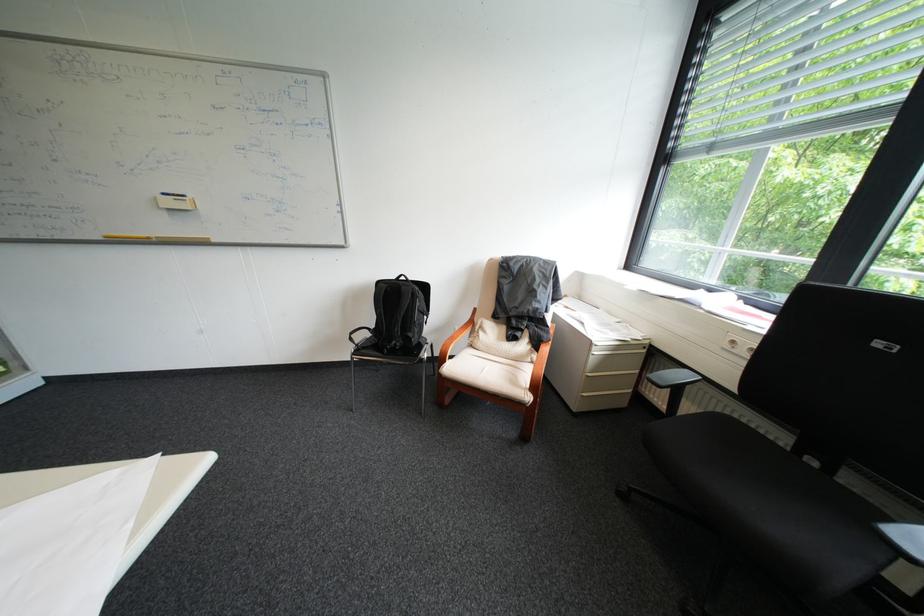
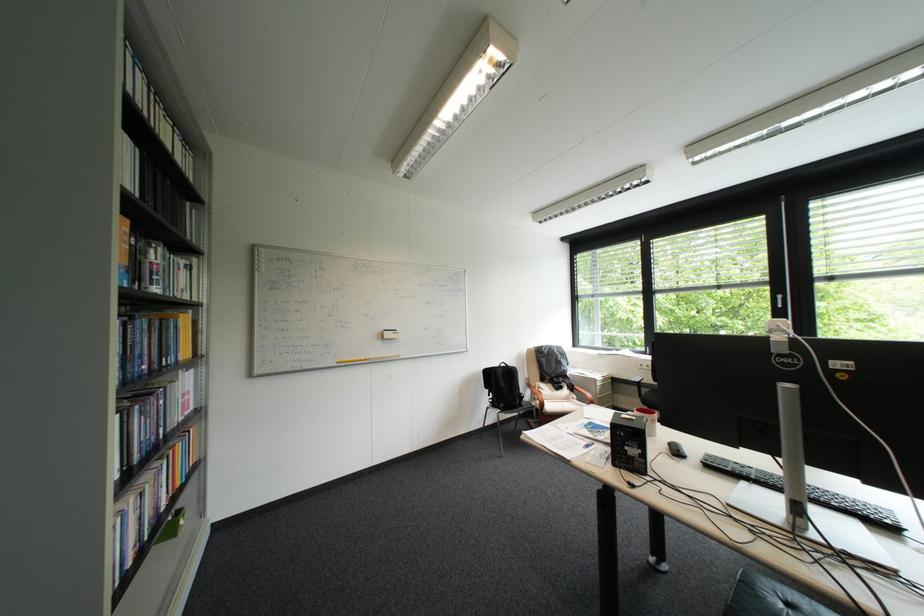
Locate, in the second image, the point that corresponds to (117,235) in the first image.

(350, 361)